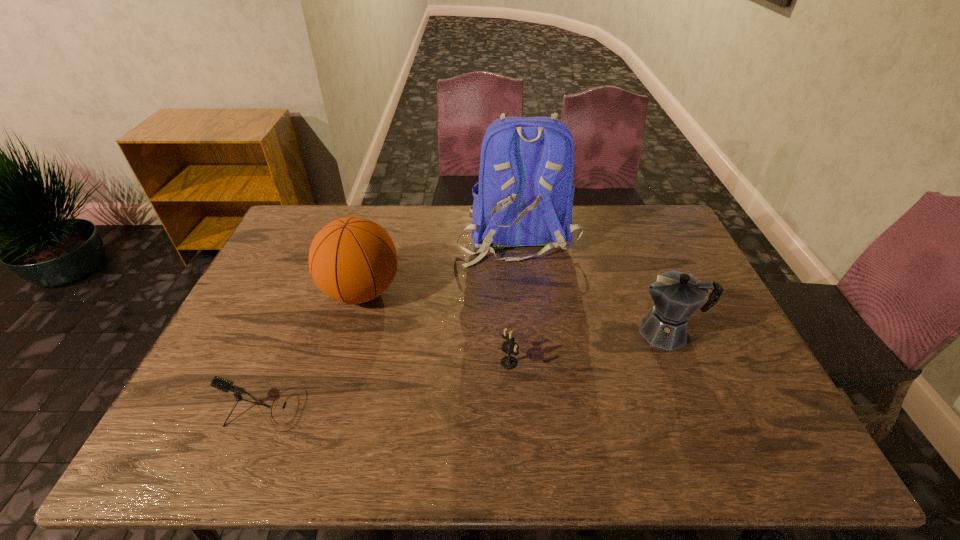
Find the location of `empty space between the tallest object and the nearest object`. empty space between the tallest object and the nearest object is located at coordinates (391, 322).

The width and height of the screenshot is (960, 540). In order to click on free space between the candle holder and the nearest object in this screenshot , I will do `click(387, 386)`.

You are a GUI agent. You are given a task and a screenshot of the screen. Output one action in this format:
    pyautogui.click(x=<x>, y=<y>)
    Task: Click on the vacant area that lies between the microphone and the fourth farthest object
    This screenshot has height=540, width=960.
    Given the screenshot: What is the action you would take?
    pyautogui.click(x=387, y=386)

Where is `free spot between the fourth shortest object and the microphone`? The width and height of the screenshot is (960, 540). free spot between the fourth shortest object and the microphone is located at coordinates (314, 350).

Find the location of a particular element. The height and width of the screenshot is (540, 960). free space between the nearest object and the third tallest object is located at coordinates (467, 370).

Where is `object that is the third closest to the basketball`? The width and height of the screenshot is (960, 540). object that is the third closest to the basketball is located at coordinates (509, 347).

Locate an element on the screen. This screenshot has height=540, width=960. object that is the fourth closest to the third tallest object is located at coordinates (225, 385).

Where is `blank space that satisfies the following two spatial constraints: 1. on the front side of the basketball; 2. on the stand of the nearest object`? The width and height of the screenshot is (960, 540). blank space that satisfies the following two spatial constraints: 1. on the front side of the basketball; 2. on the stand of the nearest object is located at coordinates (328, 409).

Identify the location of vacant position in the image that satisfies the following two spatial constraints: 1. on the front side of the fourth farthest object; 2. on the stand of the nearest object. (512, 409).